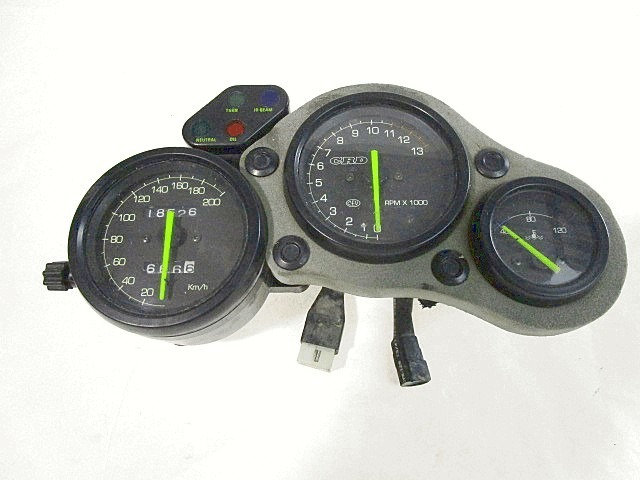
This screenshot has height=480, width=640. I want to click on plug, so click(323, 341).